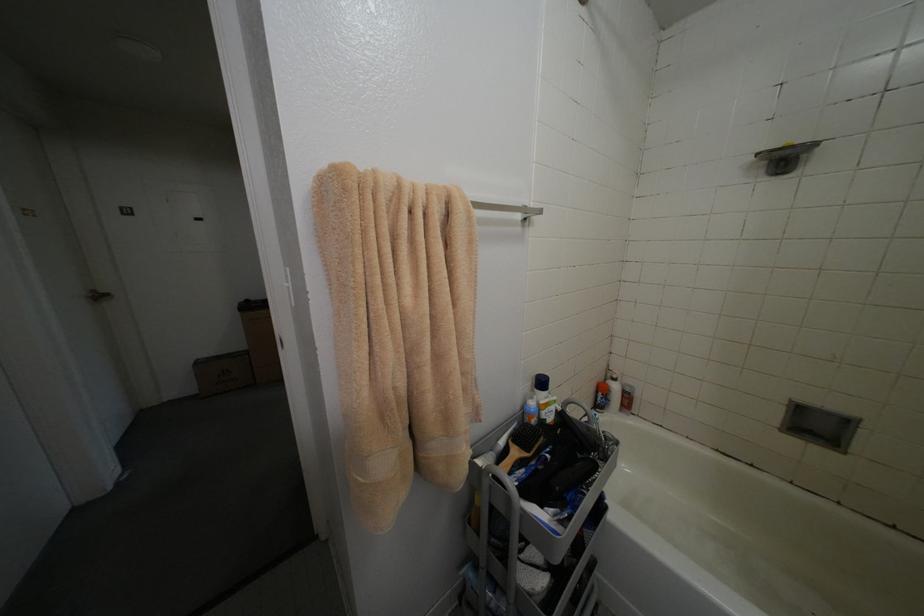
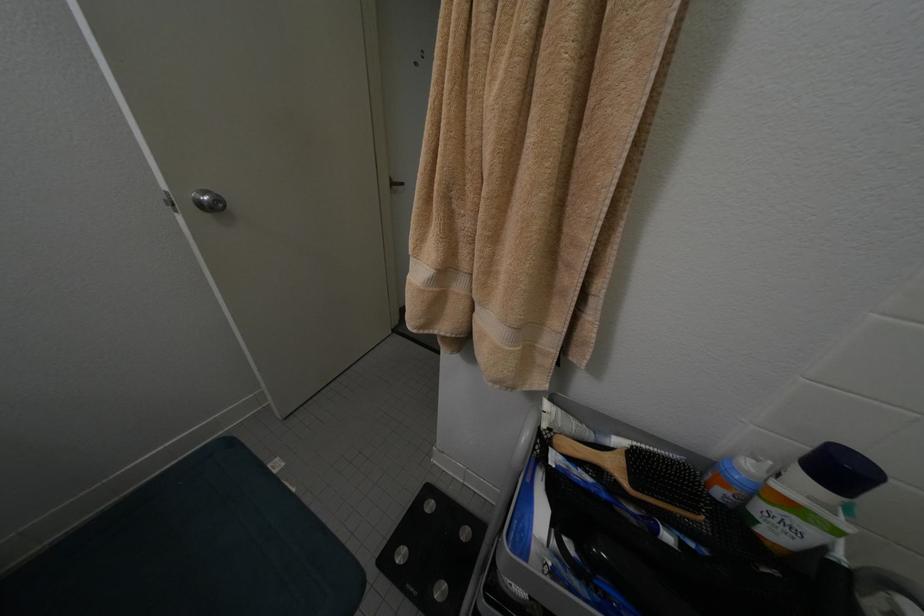
In the scene shown: First-person continuous shooting, in which direction is the camera rotating?

The rotation direction of the camera is left-down.